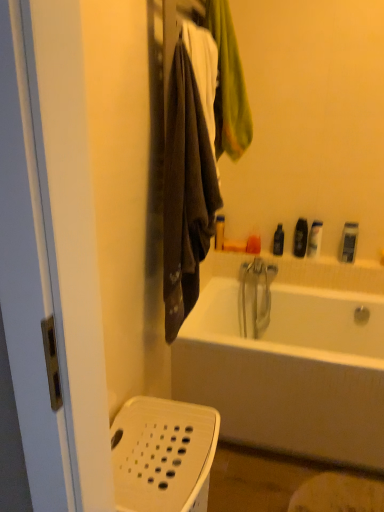
Where is `free space above white perforated basket at lower left (from a real-world perspective)`? The width and height of the screenshot is (384, 512). free space above white perforated basket at lower left (from a real-world perspective) is located at coordinates (158, 431).